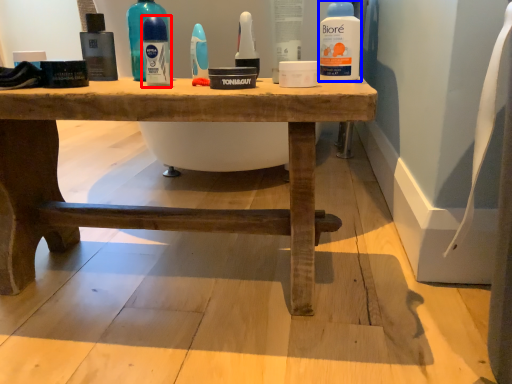
Question: Which point is further to the camera, mouthwash (highlighted by a red box) or cleaning product (highlighted by a blue box)?

Choices:
 (A) mouthwash
 (B) cleaning product

Answer: (A)